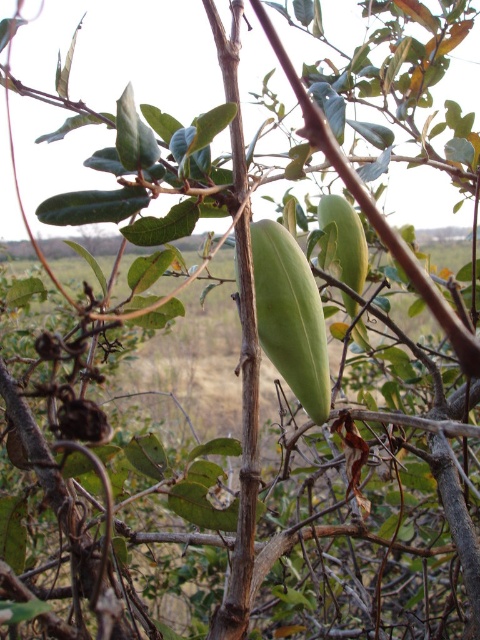
Question: Which point appears closest to the camera in this image?

Choices:
 (A) (x=349, y=218)
 (B) (x=272, y=266)

Answer: (B)

Question: Does green matte pod at center appear under green matte fruit at center?

Choices:
 (A) no
 (B) yes

Answer: (B)

Question: Can you confirm if green matte pod at center is positioned above green matte fruit at center?

Choices:
 (A) yes
 (B) no

Answer: (B)

Question: Does green matte pod at center have a smaller size compared to green matte fruit at center?

Choices:
 (A) yes
 (B) no

Answer: (A)

Question: Which point is closer to the camera?

Choices:
 (A) green matte fruit at center
 (B) green matte pod at center

Answer: (B)